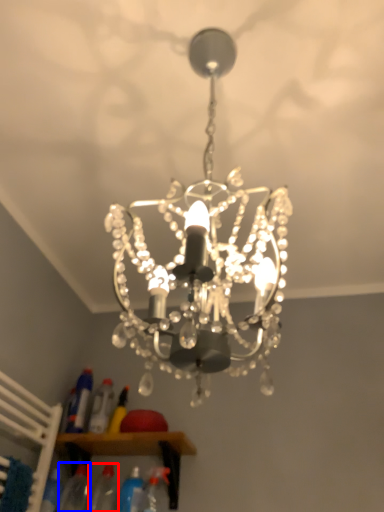
Question: Which object is closer to the camera taking this photo, bottle (highlighted by a red box) or bottle (highlighted by a blue box)?

Choices:
 (A) bottle
 (B) bottle

Answer: (A)